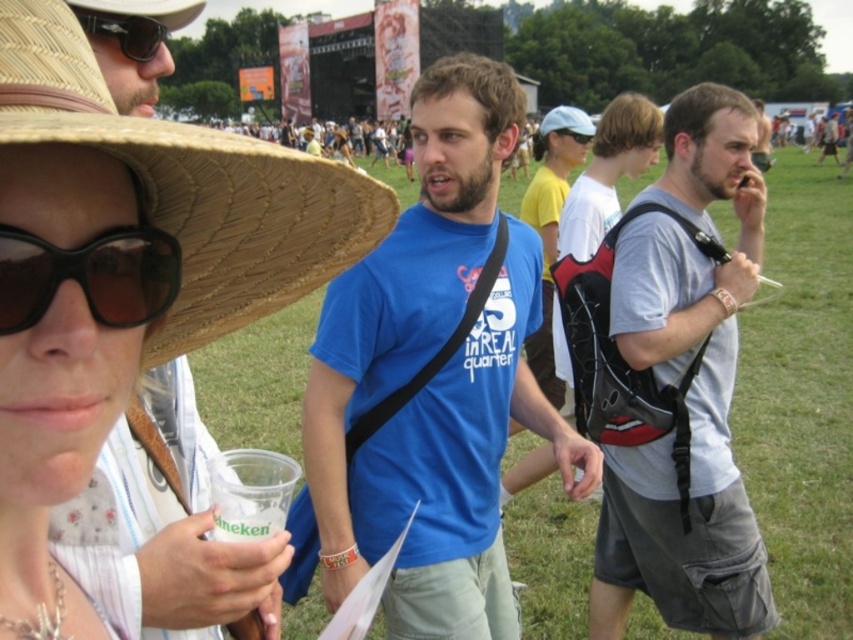
Question: In this image, where is gray fabric backpack at right located relative to matte black sunglasses at upper left?

Choices:
 (A) left
 (B) right

Answer: (B)

Question: Which of the following is the farthest from the observer?

Choices:
 (A) (593, 627)
 (B) (587, 144)
 (C) (543, 131)
 (D) (158, 22)

Answer: (B)

Question: Is brown straw cowboy hat at upper left wider than matte black goggles at upper center?

Choices:
 (A) no
 (B) yes

Answer: (B)

Question: Which of the following is the closest to the observer?

Choices:
 (A) black matte goggles at center
 (B) matte black goggles at upper center

Answer: (A)

Question: Estimate the real-world distances between objects in this image. Which object is closer to the blue cotton t-shirt at center?

Choices:
 (A) brown straw cowboy hat at upper left
 (B) matte black sunglasses at upper left

Answer: (A)

Question: Is blue cotton t-shirt at center to the right of matte black goggles at upper center from the viewer's perspective?

Choices:
 (A) yes
 (B) no

Answer: (B)